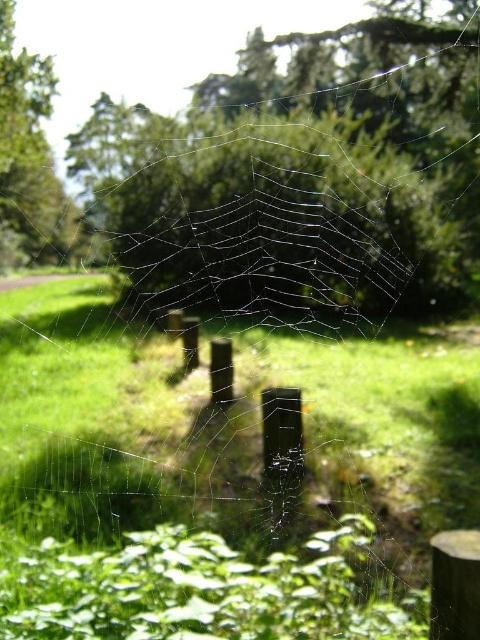
You are a gardener who wants to plant a new flower bed. You notice the green grass at center and the green leafy tree at upper left in the scene. Which object is located below the other?

The green grass at center is positioned under the green leafy tree at upper left, so the grass is below the tree.

You are a gardener who wants to trim the green grass at center so that it doesn not interfere with the transparent web at center. Based on the scene description, what should you consider about their heights?

The green grass at center has a lesser height compared to transparent web at center, so you can trim the green grass at center to ensure it does not grow taller than the transparent web at center.